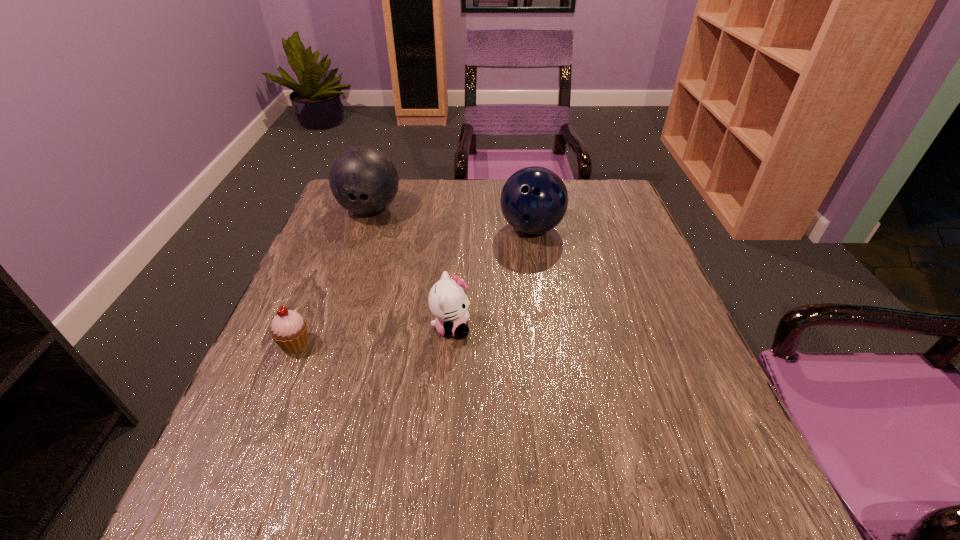
You are a GUI agent. You are given a task and a screenshot of the screen. Output one action in this format:
    pyautogui.click(x=<x>, y=<y>)
    Task: Click on the cupcake present at the left edge
    This screenshot has width=960, height=540.
    Given the screenshot: What is the action you would take?
    pyautogui.click(x=288, y=329)

The width and height of the screenshot is (960, 540). Find the location of `object located in the far left corner section of the desktop`. object located in the far left corner section of the desktop is located at coordinates (363, 180).

Locate an element on the screen. Image resolution: width=960 pixels, height=540 pixels. vacant space at the far edge of the desktop is located at coordinates pyautogui.click(x=476, y=186).

In the image, there is a desktop. At what (x,y) coordinates should I click in order to perform the action: click on vacant space at the near edge. Please return your answer as a coordinate pair (x, y). Looking at the image, I should click on (427, 484).

Where is `vacant space at the left edge`? The height and width of the screenshot is (540, 960). vacant space at the left edge is located at coordinates (371, 239).

This screenshot has width=960, height=540. In the image, there is a desktop. Identify the location of vacant space at the right edge. (622, 288).

In the image, there is a desktop. At what (x,y) coordinates should I click in order to perform the action: click on free space at the near left corner. Please return your answer as a coordinate pair (x, y). The width and height of the screenshot is (960, 540). Looking at the image, I should click on (208, 535).

This screenshot has width=960, height=540. In the image, there is a desktop. In order to click on free space at the far right corner in this screenshot , I will do `click(599, 217)`.

The image size is (960, 540). Identify the location of empty space that is in between the cupcake and the kitten. (373, 336).

Where is `vacant point located between the shortest object and the right bowling ball`? The height and width of the screenshot is (540, 960). vacant point located between the shortest object and the right bowling ball is located at coordinates (414, 287).